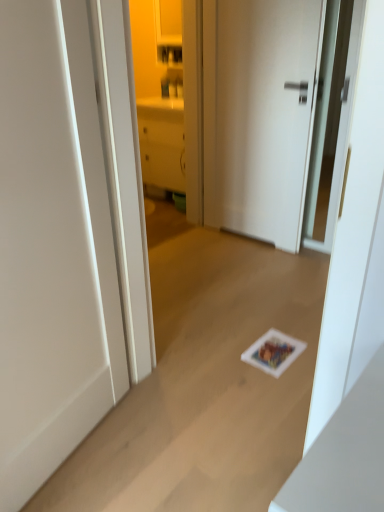
Question: Can you see white matte door at center, the 1th door when ordered from back to front, touching white matte door at center, acting as the second door starting from the right?

Choices:
 (A) no
 (B) yes

Answer: (A)

Question: Is white matte door at center, the 1th door when ordered from back to front, shorter than white matte door at center, the first door from the front?

Choices:
 (A) yes
 (B) no

Answer: (B)

Question: Could you tell me if white matte door at center, the second door when ordered from left to right, is turned towards white matte door at center, the first door from the front?

Choices:
 (A) no
 (B) yes

Answer: (B)

Question: Can you confirm if white matte door at center, the second door when ordered from left to right, is taller than white matte door at center, the 1th door viewed from the left?

Choices:
 (A) no
 (B) yes

Answer: (B)

Question: Does white matte door at center, which is the first door from right to left, appear on the left side of white matte door at center, which is the 2th door from back to front?

Choices:
 (A) yes
 (B) no

Answer: (B)

Question: Is matte white cabinet at center to the left or to the right of white matte door at center, the 1th door when ordered from back to front, in the image?

Choices:
 (A) right
 (B) left

Answer: (B)

Question: Considering the positions of matte white cabinet at center and white matte door at center, the 1th door when ordered from back to front, in the image, is matte white cabinet at center taller or shorter than white matte door at center, the 1th door when ordered from back to front,?

Choices:
 (A) tall
 (B) short

Answer: (A)

Question: Is matte white cabinet at center situated inside white matte door at center, the second door in the front-to-back sequence, or outside?

Choices:
 (A) inside
 (B) outside

Answer: (B)

Question: Considering the positions of matte white cabinet at center and white matte door at center, the second door when ordered from left to right, in the image, is matte white cabinet at center wider or thinner than white matte door at center, the second door when ordered from left to right,?

Choices:
 (A) thin
 (B) wide

Answer: (B)

Question: Is white matte door at center, the first door from the front, wider or thinner than white matte door at center, the second door in the front-to-back sequence?

Choices:
 (A) thin
 (B) wide

Answer: (B)

Question: Is point (56, 381) positioned closer to the camera than point (306, 113)?

Choices:
 (A) closer
 (B) farther

Answer: (A)

Question: Considering the positions of white matte door at center, the 1th door viewed from the left, and white matte door at center, the 1th door when ordered from back to front, in the image, is white matte door at center, the 1th door viewed from the left, taller or shorter than white matte door at center, the 1th door when ordered from back to front,?

Choices:
 (A) tall
 (B) short

Answer: (B)

Question: Is white matte door at center, the 1th door viewed from the left, spatially inside white matte door at center, the 1th door when ordered from back to front, or outside of it?

Choices:
 (A) inside
 (B) outside

Answer: (B)

Question: Does point (14, 268) appear closer or farther from the camera than point (140, 131)?

Choices:
 (A) closer
 (B) farther

Answer: (A)

Question: Do you think white matte door at center, which is the 2th door from back to front, is within matte white cabinet at center, or outside of it?

Choices:
 (A) outside
 (B) inside

Answer: (A)